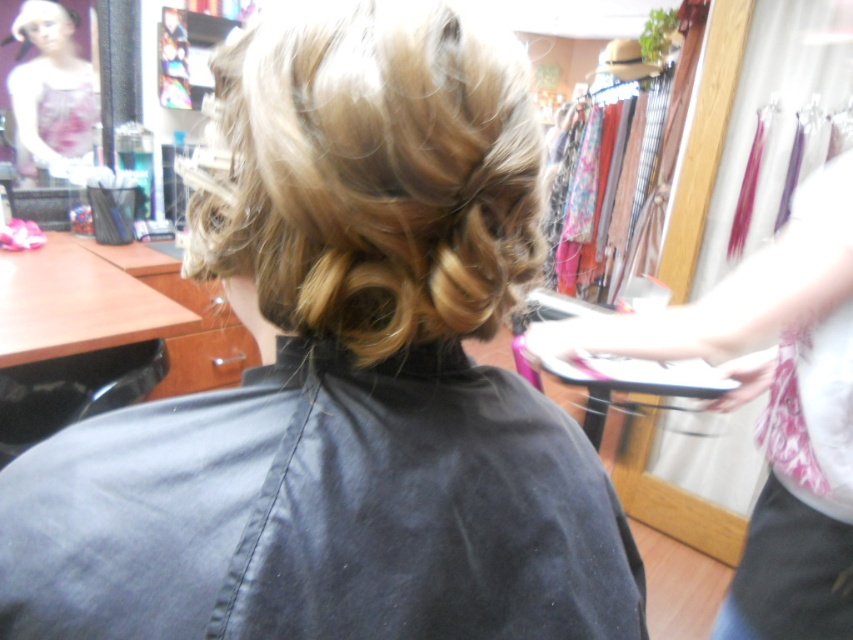
You are a customer in the hair salon and want to choose between the white fabric at right and the matte floral apron at upper left to cover your clothes during the hair service. Based on their sizes, which one would you pick and why?

The white fabric at right is bigger than the matte floral apron at upper left, so you should choose the white fabric at right because it offers more coverage for your clothes during the hair service.

In the hair salon scene, there is a white fabric at right and a matte floral apron at upper left. Which object is wider?

The white fabric at right is wider than the matte floral apron at upper left.